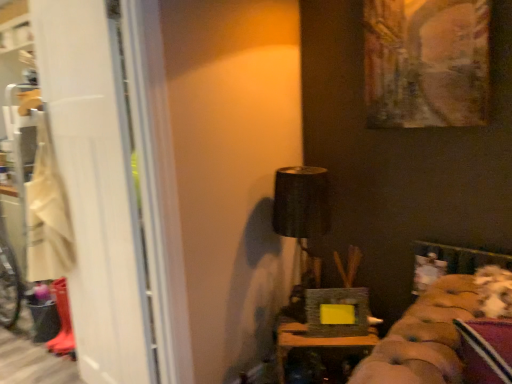
Question: From the image's perspective, is matte black picture frame at center, which is the second picture frame from right to left, located above wooden textured box at center?

Choices:
 (A) no
 (B) yes

Answer: (B)

Question: From a real-world perspective, is matte black picture frame at center, positioned as the 1th picture frame in bottom-to-top order, over wooden textured box at center?

Choices:
 (A) yes
 (B) no

Answer: (A)

Question: Considering the relative sizes of matte black picture frame at center, acting as the second picture frame starting from the top, and wooden textured box at center in the image provided, is matte black picture frame at center, acting as the second picture frame starting from the top, thinner than wooden textured box at center?

Choices:
 (A) yes
 (B) no

Answer: (A)

Question: From the image's perspective, does matte black picture frame at center, which is the first picture frame in left-to-right order, appear lower than wooden textured box at center?

Choices:
 (A) no
 (B) yes

Answer: (A)

Question: Does matte black picture frame at center, acting as the second picture frame starting from the top, come in front of wooden textured box at center?

Choices:
 (A) no
 (B) yes

Answer: (A)

Question: Is the depth of matte black picture frame at center, which is the first picture frame in left-to-right order, greater than that of wooden textured box at center?

Choices:
 (A) yes
 (B) no

Answer: (A)

Question: Can you confirm if matte black picture frame at center, acting as the second picture frame starting from the top, is bigger than black fabric lampshade at upper center?

Choices:
 (A) yes
 (B) no

Answer: (B)

Question: Considering the relative positions of matte black picture frame at center, which is the second picture frame from right to left, and black fabric lampshade at upper center in the image provided, is matte black picture frame at center, which is the second picture frame from right to left, behind black fabric lampshade at upper center?

Choices:
 (A) no
 (B) yes

Answer: (B)

Question: Is there a large distance between matte black picture frame at center, which is the second picture frame from right to left, and black fabric lampshade at upper center?

Choices:
 (A) yes
 (B) no

Answer: (B)

Question: Is matte black picture frame at center, acting as the second picture frame starting from the top, in contact with black fabric lampshade at upper center?

Choices:
 (A) no
 (B) yes

Answer: (A)

Question: Does matte black picture frame at center, positioned as the 1th picture frame in bottom-to-top order, have a greater width compared to black fabric lampshade at upper center?

Choices:
 (A) no
 (B) yes

Answer: (A)

Question: From a real-world perspective, is matte black picture frame at center, which is the first picture frame in left-to-right order, beneath black fabric lampshade at upper center?

Choices:
 (A) yes
 (B) no

Answer: (A)

Question: Could beige fabric laundry at left be considered to be inside white matte screen door at left?

Choices:
 (A) no
 (B) yes

Answer: (A)